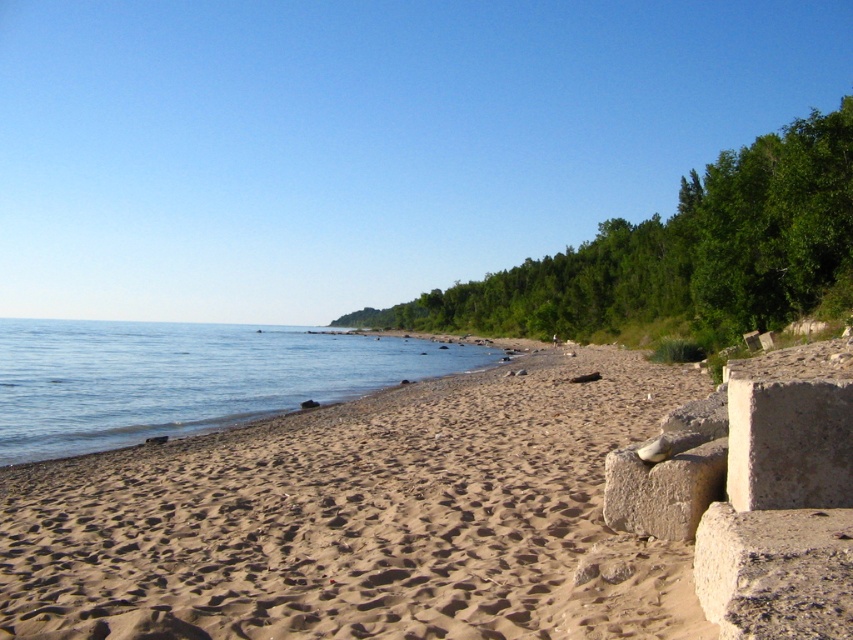
Question: Can you confirm if fine-grained sand at lower left is positioned to the left of clear water at lower left?

Choices:
 (A) no
 (B) yes

Answer: (A)

Question: Does clear water at lower left appear under gray rough concrete at lower right?

Choices:
 (A) no
 (B) yes

Answer: (B)

Question: Does fine-grained sand at lower left appear on the right side of clear water at lower left?

Choices:
 (A) yes
 (B) no

Answer: (A)

Question: Which object is the closest to the gray rough concrete at lower right?

Choices:
 (A) clear water at lower left
 (B) fine-grained sand at lower left

Answer: (B)

Question: Which object is positioned farthest from the clear water at lower left?

Choices:
 (A) gray rough concrete at lower right
 (B) fine-grained sand at lower left

Answer: (A)

Question: Considering the real-world distances, which object is closest to the clear water at lower left?

Choices:
 (A) fine-grained sand at lower left
 (B) gray rough concrete at lower right

Answer: (A)